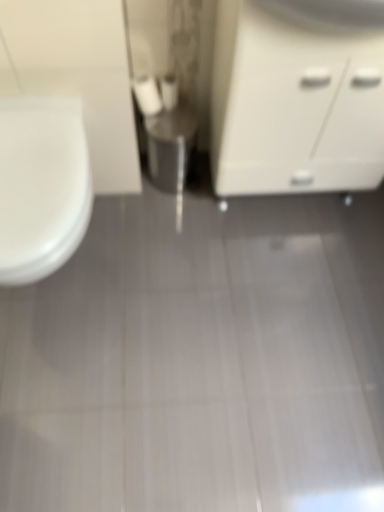
The image size is (384, 512). Find the location of `vacant region above white glossy toilet at left (from a real-world perspective)`. vacant region above white glossy toilet at left (from a real-world perspective) is located at coordinates (35, 158).